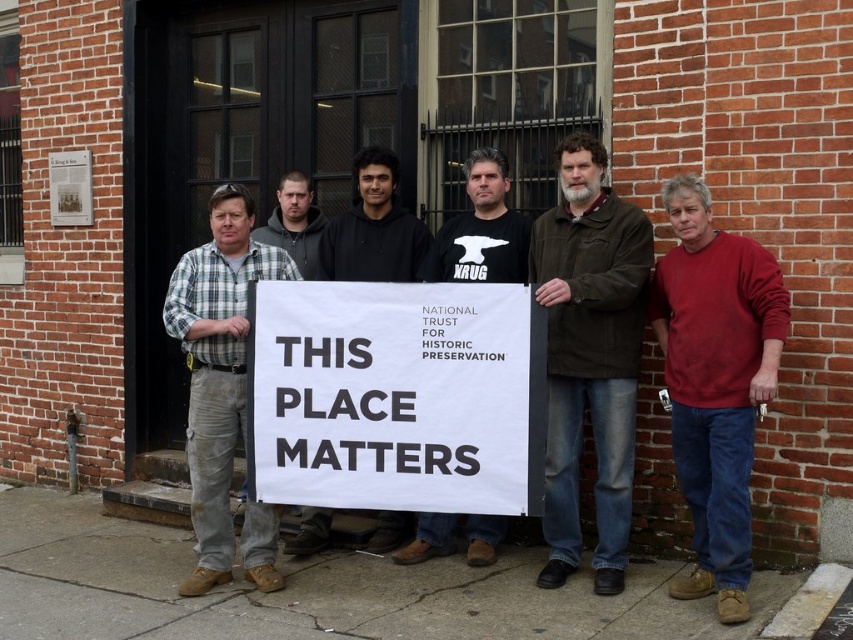
Can you confirm if dark brown leather jacket at center is wider than red cotton sweater at right?

Yes.

Between dark brown leather jacket at center and red cotton sweater at right, which one has more height?

Standing taller between the two is dark brown leather jacket at center.

Image resolution: width=853 pixels, height=640 pixels. I want to click on dark brown leather jacket at center, so click(x=589, y=355).

Identify the location of dark brown leather jacket at center. (589, 355).

Is red cotton sweater at right in front of black matte shirt at center?

Yes, red cotton sweater at right is closer to the viewer.

Between point (679, 452) and point (468, 269), which one is positioned in front?

Positioned in front is point (679, 452).

Find the location of a particular element. red cotton sweater at right is located at coordinates (715, 381).

Who is more distant from viewer, (314, 301) or (241, 532)?

Positioned behind is point (241, 532).

Is white paper sign at center closer to the viewer compared to plaid shirt at center?

Yes, white paper sign at center is in front of plaid shirt at center.

Who is more forward, (279,493) or (198,298)?

Positioned in front is point (279,493).

Locate an element on the screen. white paper sign at center is located at coordinates (396, 396).